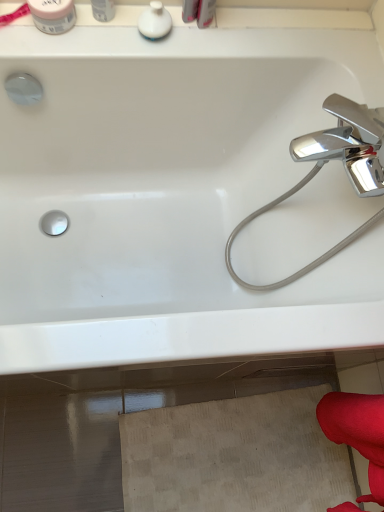
The height and width of the screenshot is (512, 384). What are the coordinates of `free spot to the right of white matte jar at upper left, the 1th toiletry positioned from the left` in the screenshot? It's located at (114, 42).